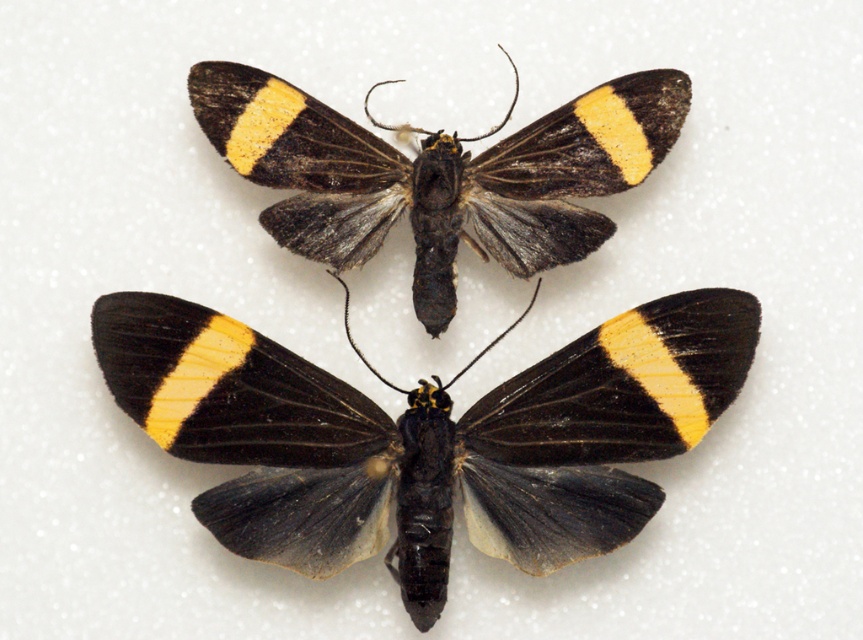
Which is behind, point (413, 484) or point (304, 134)?

Point (304, 134)

Can you confirm if black matte butterfly at center is positioned to the right of black/yellow striped moth at center?

In fact, black matte butterfly at center is to the left of black/yellow striped moth at center.

Image resolution: width=863 pixels, height=640 pixels. Identify the location of black matte butterfly at center. (426, 436).